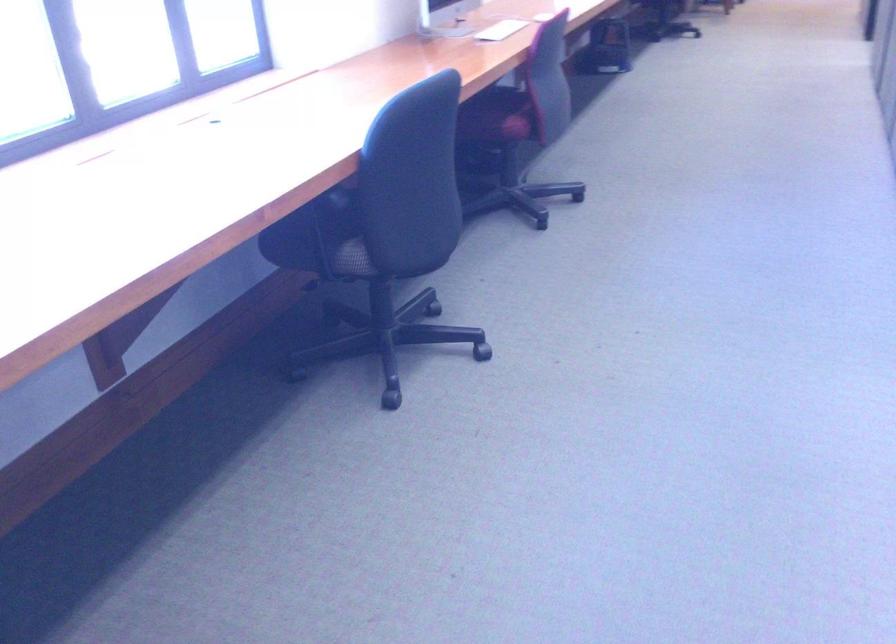
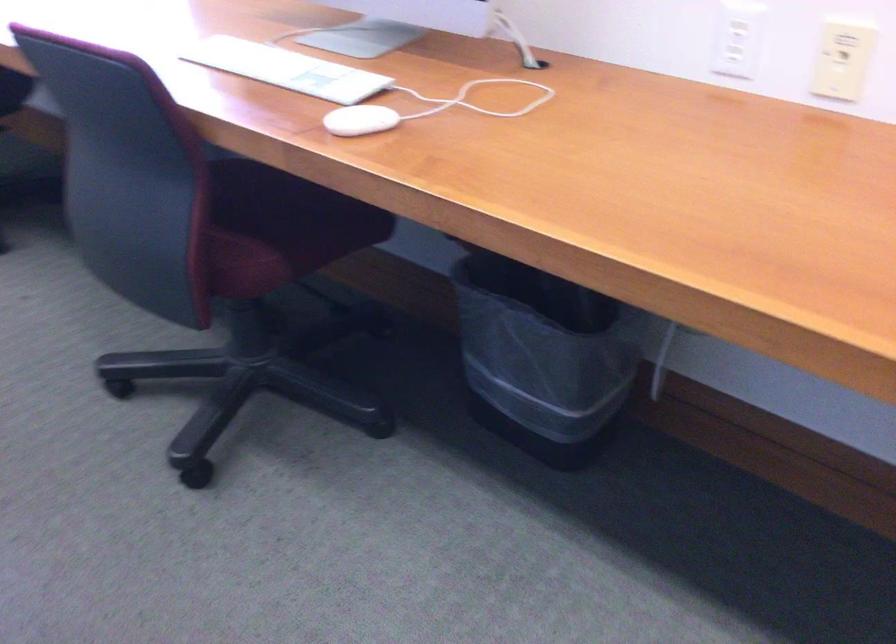
Question: I am providing you with two images of the same scene from different viewpoints. Which of the following objects are not visible in image2?

Choices:
 (A) red sword handle
 (B) black trash can
 (C) chair sitting surface
 (D) white computer mouse

Answer: (C)